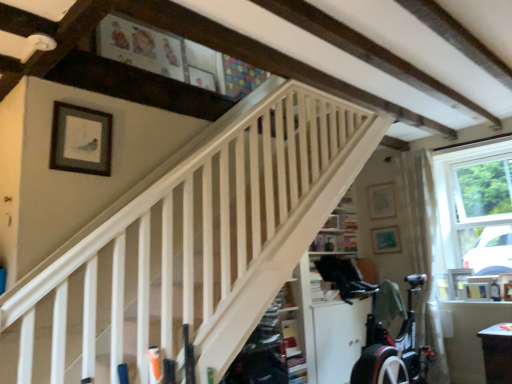
Question: From the image's perspective, does white wooden stairs at center appear lower than wooden picture frame at right, placed as the 5th picture frame when sorted from top to bottom?

Choices:
 (A) no
 (B) yes

Answer: (A)

Question: Can you confirm if white wooden stairs at center is thinner than wooden picture frame at right, which appears as the 4th picture frame when viewed from the front?

Choices:
 (A) yes
 (B) no

Answer: (B)

Question: Is white wooden stairs at center outside wooden picture frame at right, placed as the fourth picture frame when sorted from left to right?

Choices:
 (A) no
 (B) yes

Answer: (B)

Question: Is white wooden stairs at center shorter than wooden picture frame at right, which is the third picture frame from right to left?

Choices:
 (A) no
 (B) yes

Answer: (A)

Question: Does white wooden stairs at center have a smaller size compared to wooden picture frame at right, acting as the 3th picture frame starting from the back?

Choices:
 (A) no
 (B) yes

Answer: (A)

Question: Is white sheer curtain at right in front of or behind matte wooden picture frame at upper right, the 6th picture frame in the front-to-back sequence, in the image?

Choices:
 (A) front
 (B) behind

Answer: (A)

Question: From a real-world perspective, is white sheer curtain at right above or below matte wooden picture frame at upper right, the second picture frame positioned from the left?

Choices:
 (A) below
 (B) above

Answer: (A)

Question: Is white sheer curtain at right taller or shorter than matte wooden picture frame at upper right, the 1th picture frame when ordered from back to front?

Choices:
 (A) tall
 (B) short

Answer: (A)

Question: Looking at the image, does white sheer curtain at right seem bigger or smaller compared to matte wooden picture frame at upper right, the 6th picture frame in the front-to-back sequence?

Choices:
 (A) small
 (B) big

Answer: (B)

Question: Is white glossy table at lower right spatially inside matte black picture frame at upper left, which is the sixth picture frame from back to front, or outside of it?

Choices:
 (A) inside
 (B) outside

Answer: (B)

Question: In terms of size, does white glossy table at lower right appear bigger or smaller than matte black picture frame at upper left, marked as the 6th picture frame in a right-to-left arrangement?

Choices:
 (A) big
 (B) small

Answer: (A)

Question: In terms of width, does white glossy table at lower right look wider or thinner when compared to matte black picture frame at upper left, marked as the 6th picture frame in a right-to-left arrangement?

Choices:
 (A) thin
 (B) wide

Answer: (B)

Question: Considering their positions, is white glossy table at lower right located in front of or behind matte black picture frame at upper left, the first picture frame positioned from the front?

Choices:
 (A) behind
 (B) front

Answer: (A)

Question: Considering the positions of green matte picture frame at upper right, arranged as the fourth picture frame when viewed from the right, and matte black picture frame at upper left, the first picture frame positioned from the front, in the image, is green matte picture frame at upper right, arranged as the fourth picture frame when viewed from the right, wider or thinner than matte black picture frame at upper left, the first picture frame positioned from the front,?

Choices:
 (A) wide
 (B) thin

Answer: (A)

Question: Choose the correct answer: Is green matte picture frame at upper right, marked as the 4th picture frame in a bottom-to-top arrangement, inside matte black picture frame at upper left, acting as the first picture frame starting from the top, or outside it?

Choices:
 (A) inside
 (B) outside

Answer: (B)